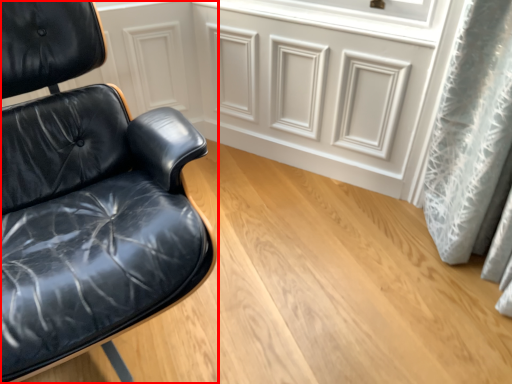
Question: From the image's perspective, where is chair (annotated by the red box) located relative to drawer?

Choices:
 (A) above
 (B) below

Answer: (B)